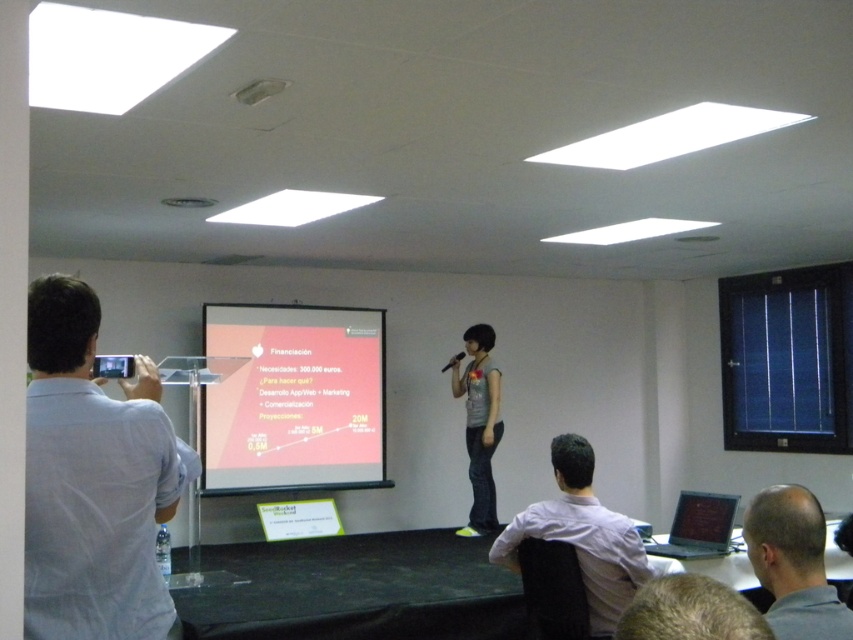
Question: Can you confirm if matte orange projector screen at center is positioned below white shirt at lower right?

Choices:
 (A) yes
 (B) no

Answer: (B)

Question: Can you confirm if white shirt at lower right is bigger than bald head at center?

Choices:
 (A) no
 (B) yes

Answer: (B)

Question: Can you confirm if white shirt at left is thinner than bald head at center?

Choices:
 (A) yes
 (B) no

Answer: (B)

Question: Which is farther from the matte gray shirt at center?

Choices:
 (A) white shirt at lower right
 (B) bald head at center
 (C) white shirt at left

Answer: (C)

Question: Estimate the real-world distances between objects in this image. Which object is closer to the bald head at center?

Choices:
 (A) matte orange projector screen at center
 (B) matte gray shirt at center
 (C) white shirt at left
 (D) white shirt at lower right

Answer: (D)

Question: Among these objects, which one is nearest to the camera?

Choices:
 (A) white shirt at lower right
 (B) matte orange projector screen at center
 (C) matte gray shirt at center
 (D) bald head at center

Answer: (D)